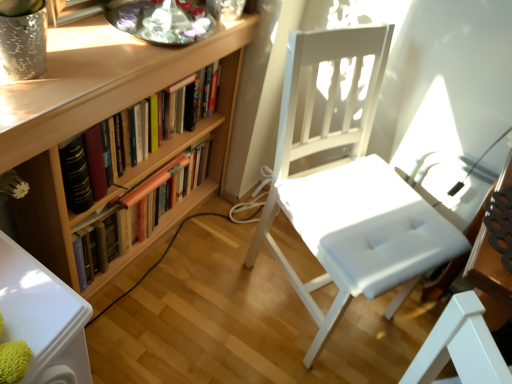
Where is `free space above wooden bookcase at left (from a real-world perspective)`? The image size is (512, 384). free space above wooden bookcase at left (from a real-world perspective) is located at coordinates (113, 35).